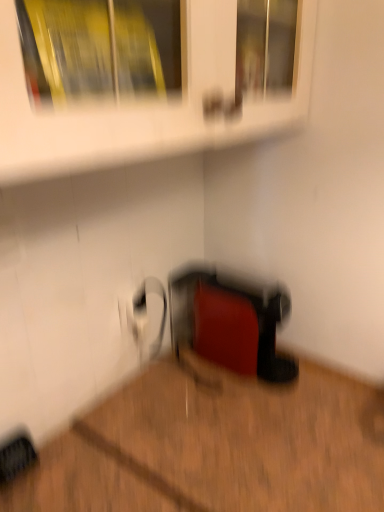
Locate an element on the screen. free spot above rubberized red toaster at lower center (from a real-world perspective) is located at coordinates (243, 283).